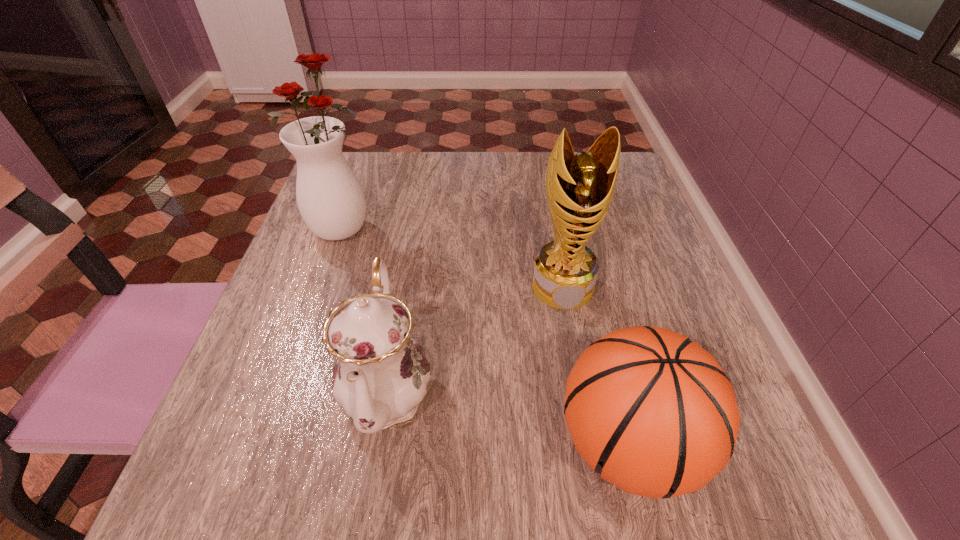
You are a GUI agent. You are given a task and a screenshot of the screen. Output one action in this format:
    pyautogui.click(x=<x>, y=<y>)
    Task: Click on the free location that satisfies the following two spatial constraints: 1. on the front-facing side of the award; 2. on the right side of the basketball
    
    Given the screenshot: What is the action you would take?
    pyautogui.click(x=591, y=444)

Find the location of a particular element. This screenshot has height=540, width=960. vacant region that satisfies the following two spatial constraints: 1. on the front side of the basketball; 2. on the left side of the farthest object is located at coordinates (264, 444).

At what (x,y) coordinates should I click in order to perform the action: click on vacant region that satisfies the following two spatial constraints: 1. on the front-facing side of the basketball; 2. on the left side of the award. Please return your answer as a coordinate pair (x, y). This screenshot has height=540, width=960. Looking at the image, I should click on (591, 444).

Find the location of a particular element. This screenshot has height=540, width=960. vacant space that satisfies the following two spatial constraints: 1. on the front-facing side of the basketball; 2. on the right side of the award is located at coordinates (591, 444).